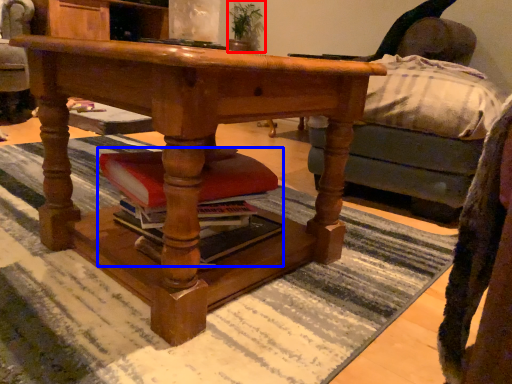
Question: Which point is further to the camera, houseplant (highlighted by a red box) or book (highlighted by a blue box)?

Choices:
 (A) houseplant
 (B) book

Answer: (A)